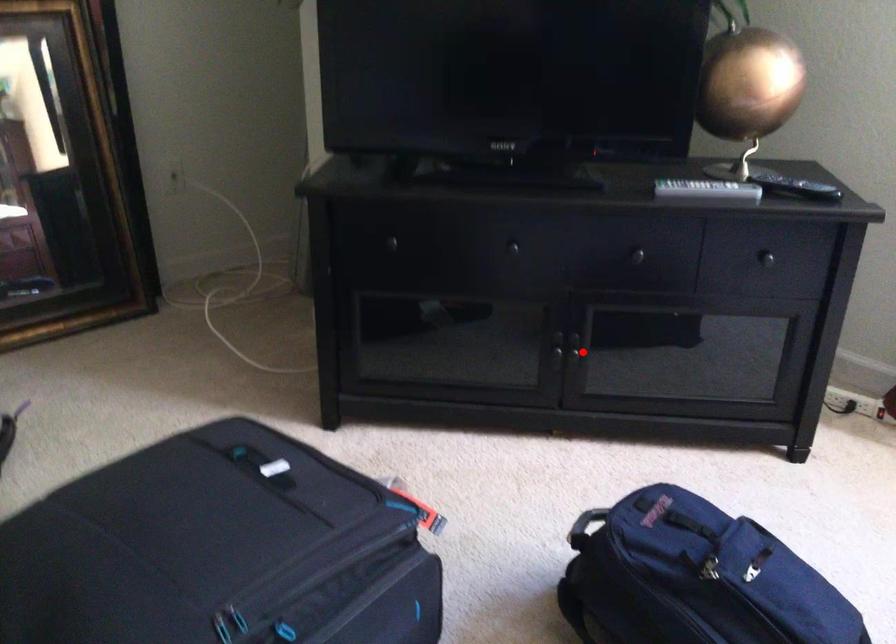
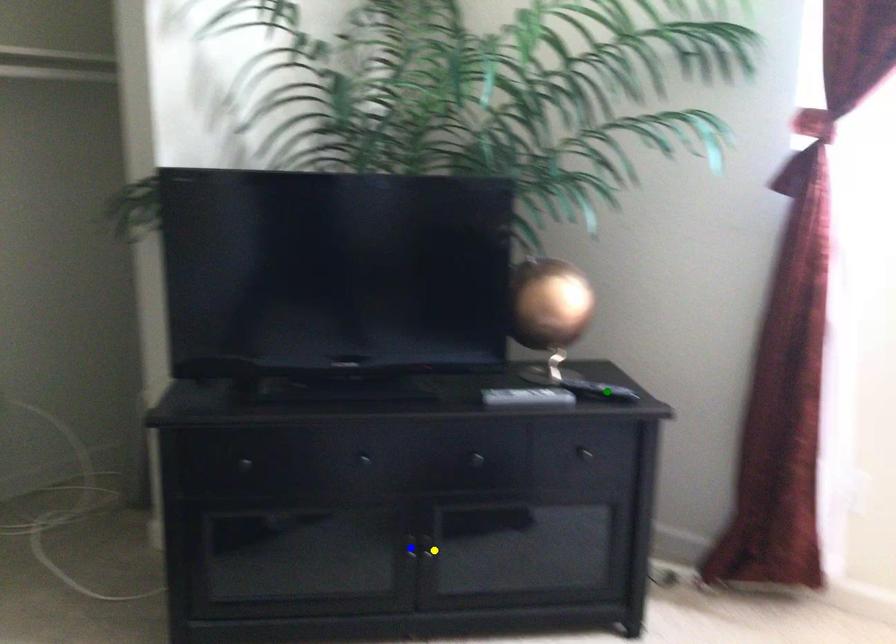
Question: I am providing you with two images of the same scene from different viewpoints. A red point is marked on the first image. You are given multiple points on the second image. In image 2, which mark is for the same physical point as the one in image 1?

Choices:
 (A) yellow point
 (B) green point
 (C) blue point

Answer: (A)